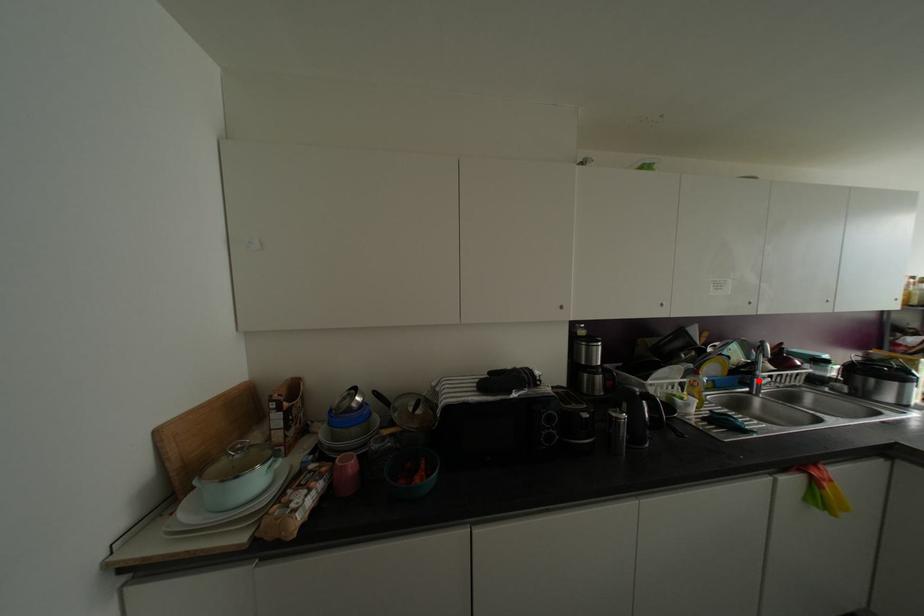
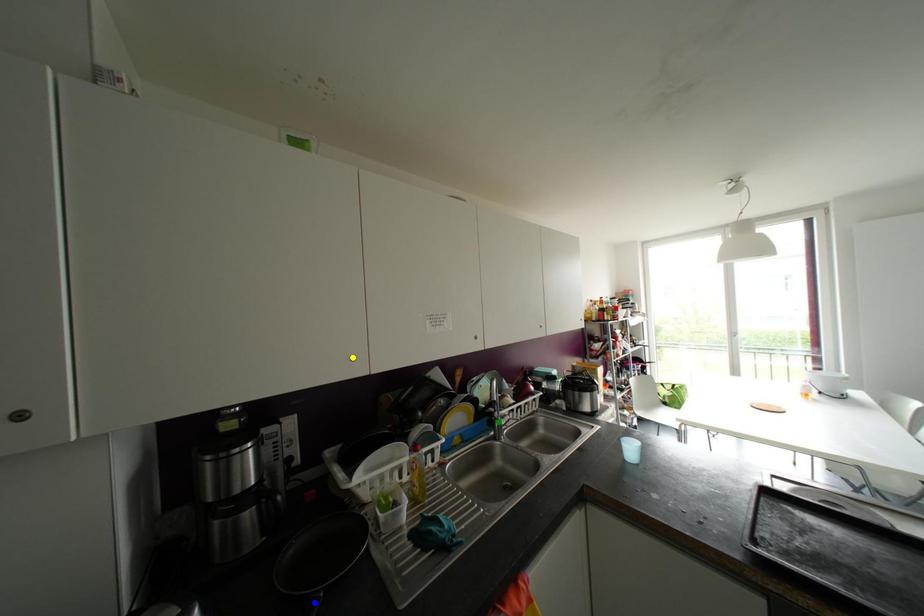
Question: I am providing you with two images of the same scene from different viewpoints. A red point is marked on the first image. You are given multiple points on the second image. Which point in image 2 represents the same 3d spot as the red point in image 1?

Choices:
 (A) green point
 (B) blue point
 (C) yellow point

Answer: (A)